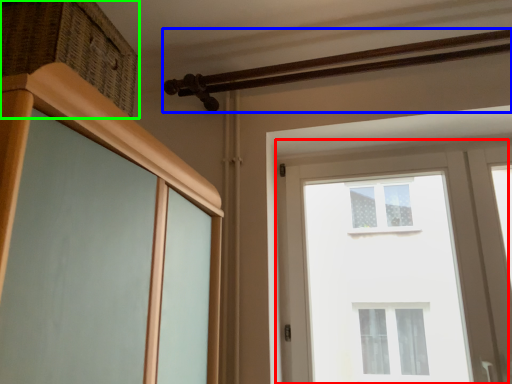
Question: Which is nearer to the window (highlighted by a red box)? rail (highlighted by a blue box) or drawer (highlighted by a green box).

Choices:
 (A) rail
 (B) drawer

Answer: (A)